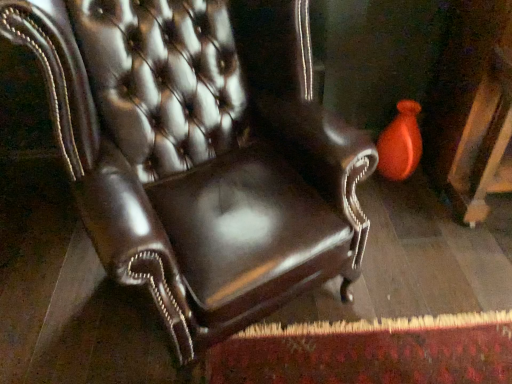
Question: Considering the relative positions of orange glossy vase at upper right and shiny leather chair at center in the image provided, is orange glossy vase at upper right behind shiny leather chair at center?

Choices:
 (A) no
 (B) yes

Answer: (B)

Question: Is orange glossy vase at upper right touching shiny leather chair at center?

Choices:
 (A) no
 (B) yes

Answer: (A)

Question: Does orange glossy vase at upper right appear on the left side of shiny leather chair at center?

Choices:
 (A) yes
 (B) no

Answer: (B)

Question: From a real-world perspective, is orange glossy vase at upper right physically below shiny leather chair at center?

Choices:
 (A) yes
 (B) no

Answer: (A)

Question: Considering the relative positions of orange glossy vase at upper right and shiny leather chair at center in the image provided, is orange glossy vase at upper right in front of shiny leather chair at center?

Choices:
 (A) yes
 (B) no

Answer: (B)

Question: Is orange glossy vase at upper right to the right of shiny leather chair at center from the viewer's perspective?

Choices:
 (A) yes
 (B) no

Answer: (A)

Question: Can you confirm if shiny leather chair at center is wider than orange glossy vase at upper right?

Choices:
 (A) no
 (B) yes

Answer: (B)

Question: Is shiny leather chair at center to the left of orange glossy vase at upper right from the viewer's perspective?

Choices:
 (A) yes
 (B) no

Answer: (A)

Question: Could you tell me if shiny leather chair at center is turned towards orange glossy vase at upper right?

Choices:
 (A) no
 (B) yes

Answer: (A)

Question: From a real-world perspective, is shiny leather chair at center under orange glossy vase at upper right?

Choices:
 (A) yes
 (B) no

Answer: (B)

Question: Considering the relative sizes of shiny leather chair at center and orange glossy vase at upper right in the image provided, is shiny leather chair at center smaller than orange glossy vase at upper right?

Choices:
 (A) no
 (B) yes

Answer: (A)

Question: Considering the relative sizes of shiny leather chair at center and orange glossy vase at upper right in the image provided, is shiny leather chair at center thinner than orange glossy vase at upper right?

Choices:
 (A) no
 (B) yes

Answer: (A)

Question: From their relative heights in the image, would you say orange glossy vase at upper right is taller or shorter than shiny leather chair at center?

Choices:
 (A) short
 (B) tall

Answer: (A)